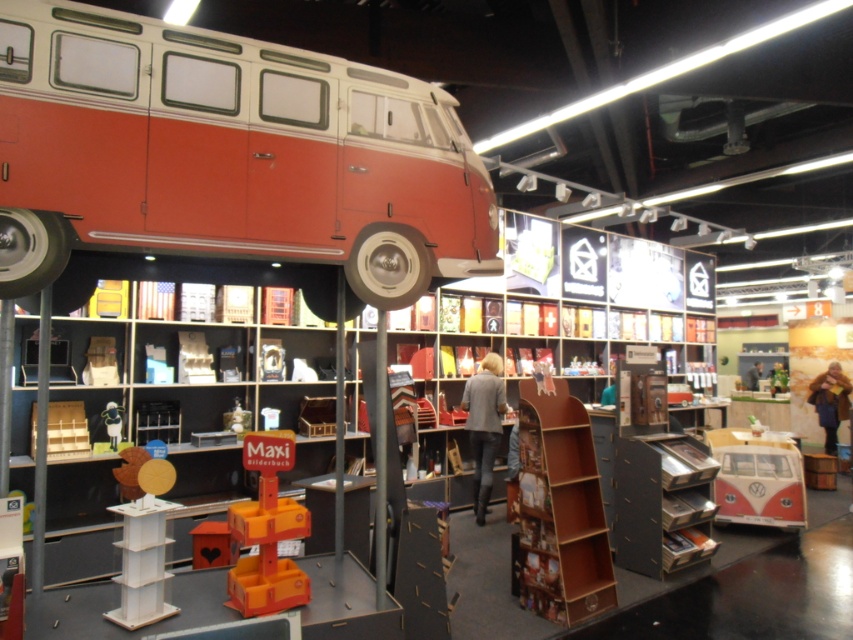
Question: Which object is closer to the camera taking this photo?

Choices:
 (A) wooden at center
 (B) matte black shelf at lower right

Answer: (A)

Question: Estimate the real-world distances between objects in this image. Which object is closer to the leather jacket at lower right?

Choices:
 (A) wooden at center
 (B) wooden block at lower left

Answer: (A)

Question: Based on their relative distances, which object is nearer to the light gray fabric jacket at center?

Choices:
 (A) matte black toy car at lower left
 (B) light brown leather jacket at center
 (C) wooden block at lower left
 (D) matte red van at upper center

Answer: (A)

Question: Is matte black shelf at lower right below matte red and white bus at lower right?

Choices:
 (A) yes
 (B) no

Answer: (B)

Question: Does light gray fabric jacket at center have a larger size compared to light brown leather jacket at center?

Choices:
 (A) no
 (B) yes

Answer: (A)

Question: In this image, where is matte red van at upper center located relative to orange plastic toy at lower center?

Choices:
 (A) right
 (B) left

Answer: (A)